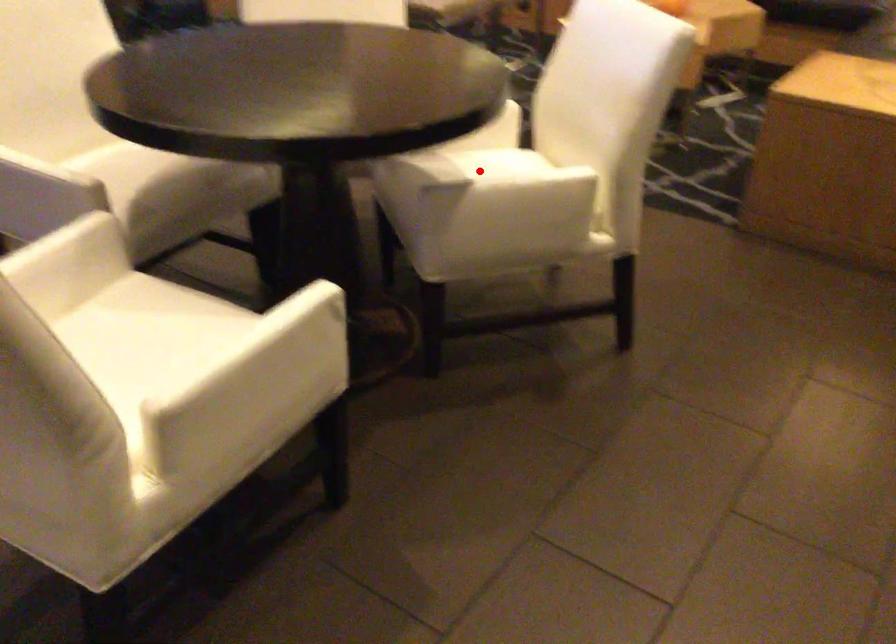
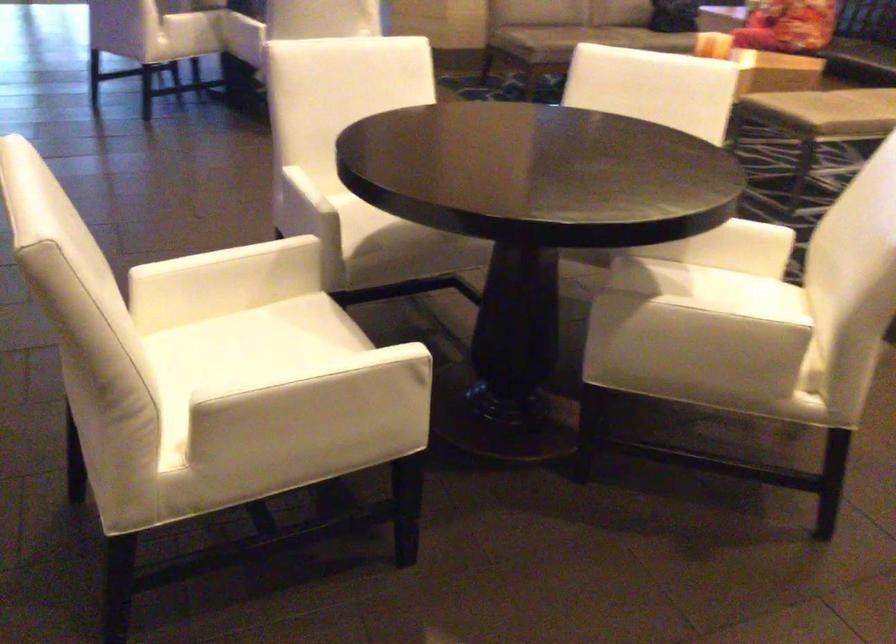
Locate, in the second image, the point that corresponds to the highlighted location in the first image.

(711, 290)